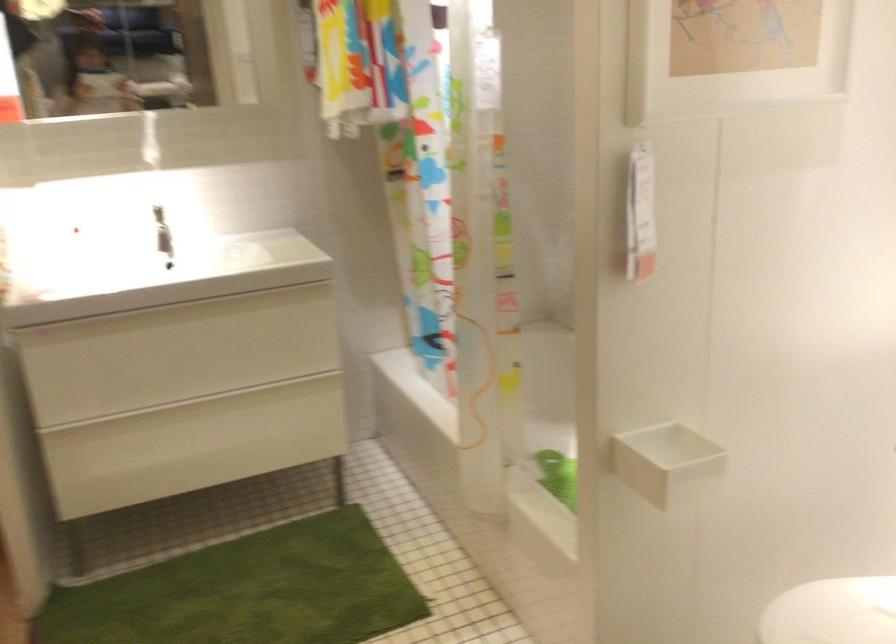
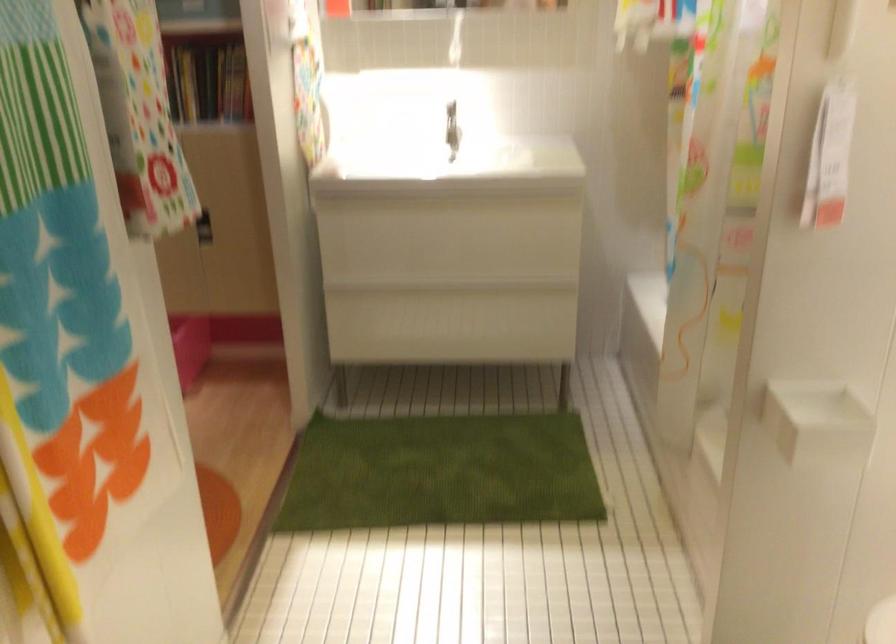
The point at [209,404] is marked in the first image. Where is the corresponding point in the second image?

(453, 288)